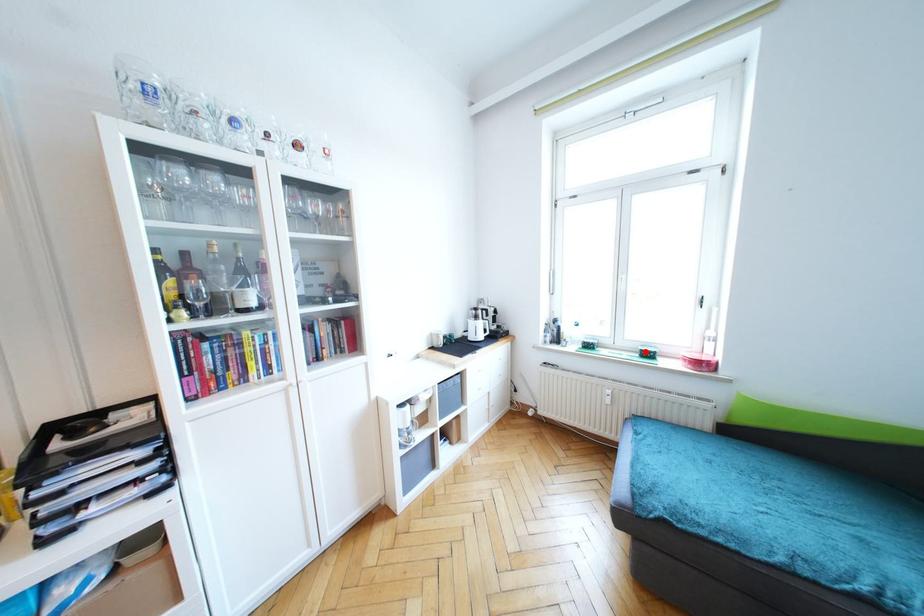
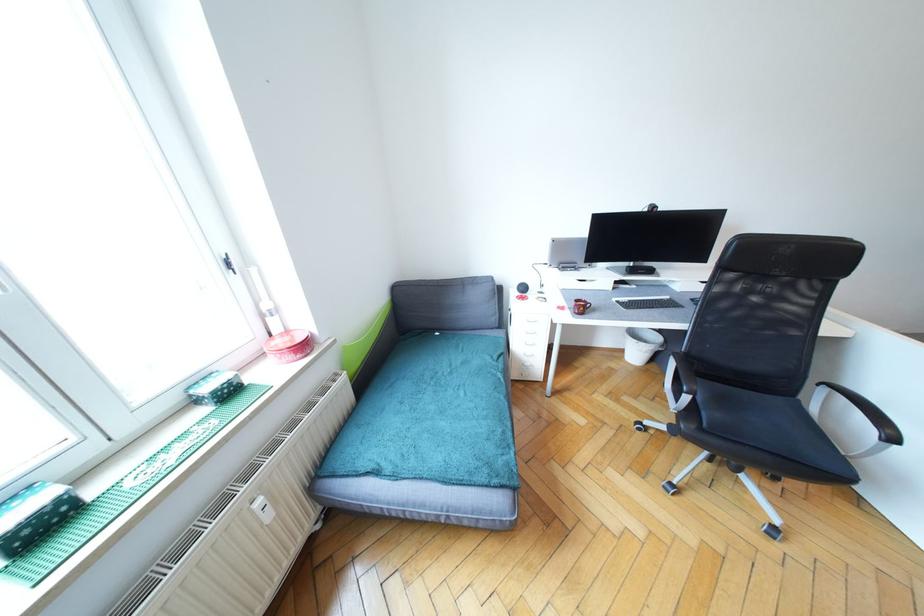
Locate, in the second image, the point that corresponds to the highlighted location in the first image.

(217, 392)